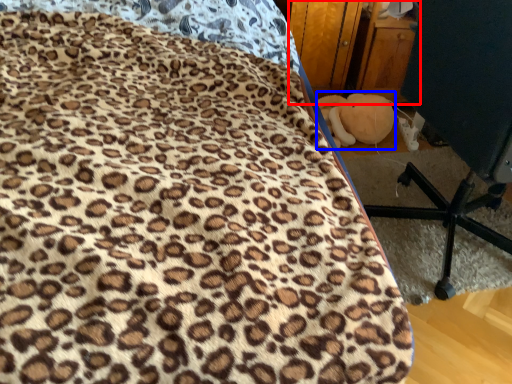
Question: Which of the following is the closest to the observer, dresser (highlighted by a red box) or toy (highlighted by a blue box)?

Choices:
 (A) dresser
 (B) toy

Answer: (A)